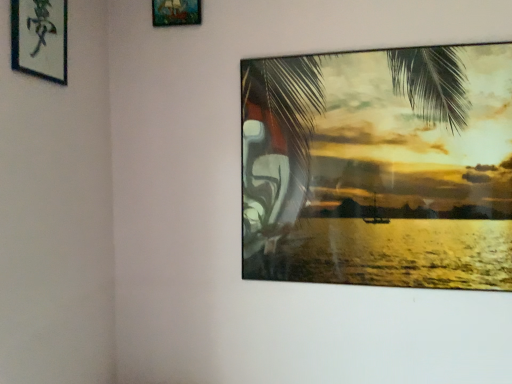
Question: Does silky green palm tree at upper right have a larger size compared to wooden frame at upper center, which ranks as the second picture frame in front-to-back order?

Choices:
 (A) no
 (B) yes

Answer: (B)

Question: Is silky green palm tree at upper right oriented towards wooden frame at upper center, the first picture frame when ordered from right to left?

Choices:
 (A) yes
 (B) no

Answer: (B)

Question: Is silky green palm tree at upper right not close to wooden frame at upper center, marked as the first picture frame in a top-to-bottom arrangement?

Choices:
 (A) yes
 (B) no

Answer: (B)

Question: Is the depth of silky green palm tree at upper right less than that of wooden frame at upper center, the 2th picture frame when ordered from left to right?

Choices:
 (A) yes
 (B) no

Answer: (A)

Question: From a real-world perspective, is silky green palm tree at upper right under wooden frame at upper center, marked as the first picture frame in a top-to-bottom arrangement?

Choices:
 (A) no
 (B) yes

Answer: (B)

Question: Is silky green palm tree at upper right inside or outside of wooden frame at upper center, the 2th picture frame positioned from the bottom?

Choices:
 (A) inside
 (B) outside

Answer: (B)

Question: Based on their positions, is silky green palm tree at upper right located to the left or right of wooden frame at upper center, which ranks as the second picture frame in front-to-back order?

Choices:
 (A) right
 (B) left

Answer: (A)

Question: Is silky green palm tree at upper right in front of or behind wooden frame at upper center, placed as the first picture frame when sorted from back to front, in the image?

Choices:
 (A) behind
 (B) front

Answer: (B)

Question: Is silky green palm tree at upper right wider or thinner than wooden frame at upper center, the first picture frame when ordered from right to left?

Choices:
 (A) thin
 (B) wide

Answer: (B)

Question: Is black paper at upper left, arranged as the second picture frame when viewed from the top, wider or thinner than silky green palm tree at upper right?

Choices:
 (A) thin
 (B) wide

Answer: (A)

Question: In the image, is black paper at upper left, arranged as the second picture frame when viewed from the top, positioned in front of or behind silky green palm tree at upper right?

Choices:
 (A) behind
 (B) front

Answer: (B)

Question: Considering the positions of black paper at upper left, arranged as the second picture frame when viewed from the top, and silky green palm tree at upper right in the image, is black paper at upper left, arranged as the second picture frame when viewed from the top, bigger or smaller than silky green palm tree at upper right?

Choices:
 (A) small
 (B) big

Answer: (A)

Question: Is point (61, 24) closer or farther from the camera than point (323, 114)?

Choices:
 (A) closer
 (B) farther

Answer: (A)

Question: From a real-world perspective, relative to silky green palm tree at upper right, is wooden frame at upper center, marked as the first picture frame in a top-to-bottom arrangement, vertically above or below?

Choices:
 (A) above
 (B) below

Answer: (A)

Question: From the image's perspective, is wooden frame at upper center, marked as the first picture frame in a top-to-bottom arrangement, above or below silky green palm tree at upper right?

Choices:
 (A) above
 (B) below

Answer: (A)